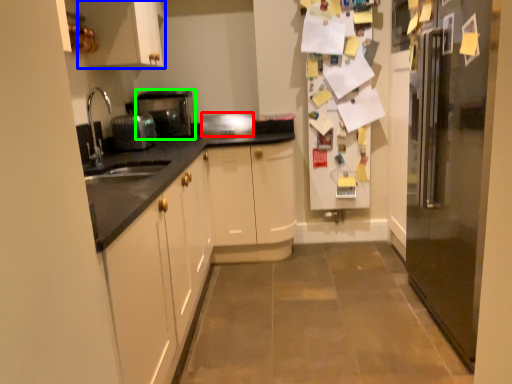
Question: Based on their relative distances, which object is nearer to appliance (highlighted by a red box)? Choose from cabinetry (highlighted by a blue box) and home appliance (highlighted by a green box).

Choices:
 (A) cabinetry
 (B) home appliance

Answer: (B)